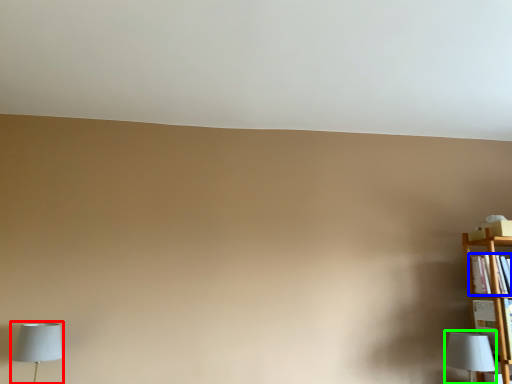
Question: Which object is the farthest from lamp (highlighted by a red box)? Choose among these: book (highlighted by a blue box) or lamp (highlighted by a green box).

Choices:
 (A) book
 (B) lamp

Answer: (A)